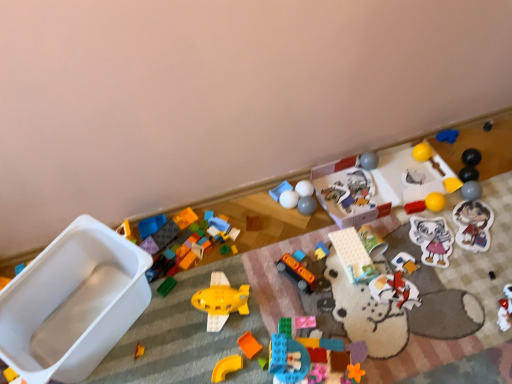
Image resolution: width=512 pixels, height=384 pixels. In order to click on free space that is in between yellow plastic curve at center, the fifth toy in the left-to-right sequence, and orange matte bus at center, the tenth toy when ordered from left to right in this screenshot , I will do `click(262, 320)`.